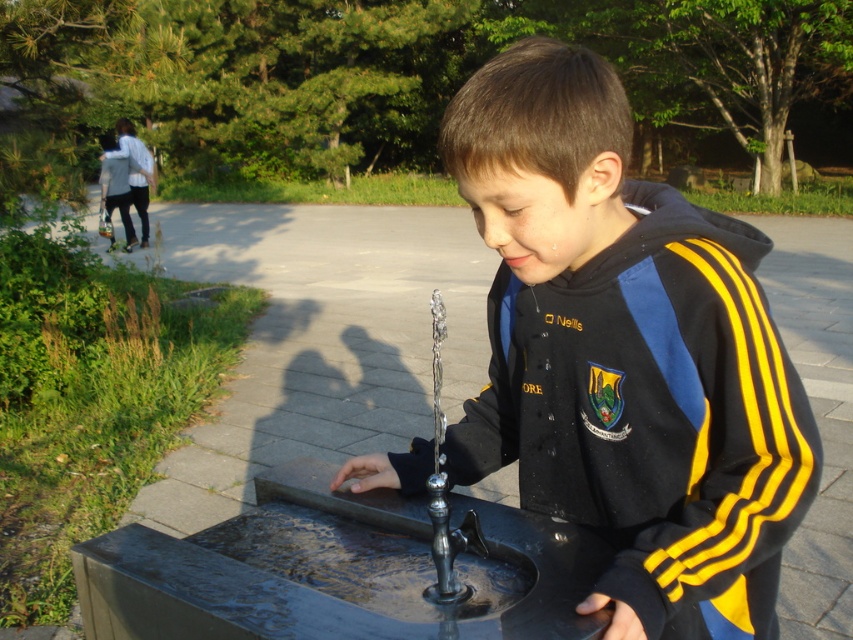
Can you confirm if black/yellow track jacket at center is smaller than transparent glass hand at center?

No.

Who is shorter, black/yellow track jacket at center or transparent glass hand at center?

With less height is transparent glass hand at center.

Who is more distant from viewer, (759,529) or (346,470)?

The point (346,470) is more distant.

The image size is (853, 640). Identify the location of black/yellow track jacket at center. (625, 355).

Does polished metal fountain at center have a lesser height compared to transparent glass hand at center?

In fact, polished metal fountain at center may be taller than transparent glass hand at center.

What do you see at coordinates (323, 570) in the screenshot? The height and width of the screenshot is (640, 853). I see `polished metal fountain at center` at bounding box center [323, 570].

Measure the distance between polished metal fountain at center and camera.

polished metal fountain at center and camera are 94.25 centimeters apart from each other.

Locate an element on the screen. polished metal fountain at center is located at coordinates (323, 570).

Is point (556, 412) closer to viewer compared to point (186, 618)?

No, (556, 412) is further to viewer.

What are the coordinates of `black/yellow track jacket at center` in the screenshot? It's located at (625, 355).

Find the location of `black/yellow track jacket at center`. black/yellow track jacket at center is located at coordinates (625, 355).